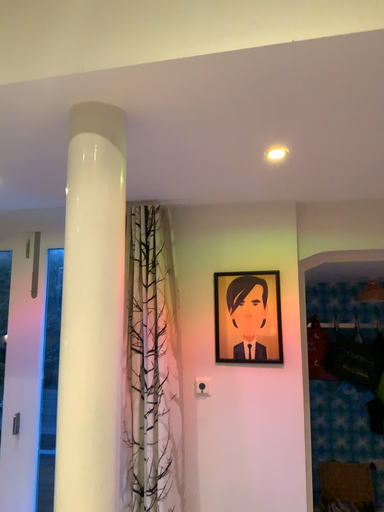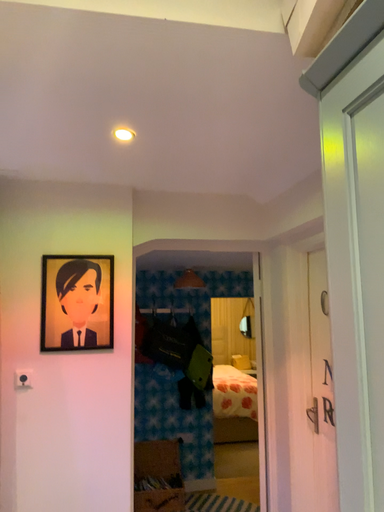
Question: Which way did the camera rotate in the video?

Choices:
 (A) rotated right
 (B) rotated left

Answer: (A)